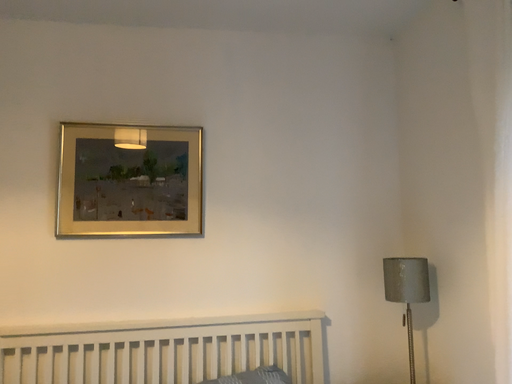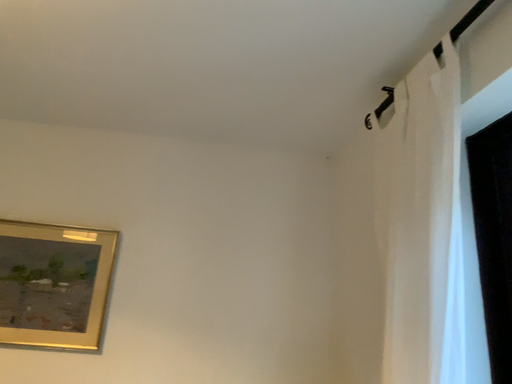
Question: Which way did the camera rotate in the video?

Choices:
 (A) rotated downward
 (B) rotated upward

Answer: (B)